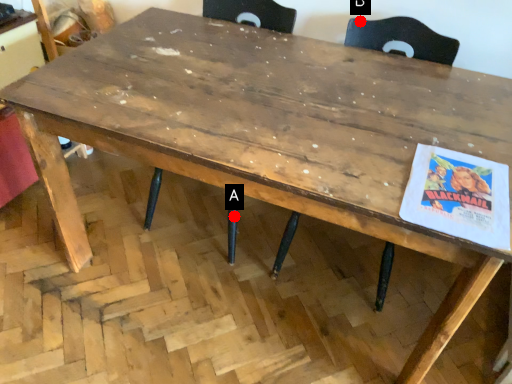
Question: Two points are circled on the image, labeled by A and B beside each circle. Which point is closer to the camera?

Choices:
 (A) A is closer
 (B) B is closer

Answer: (B)